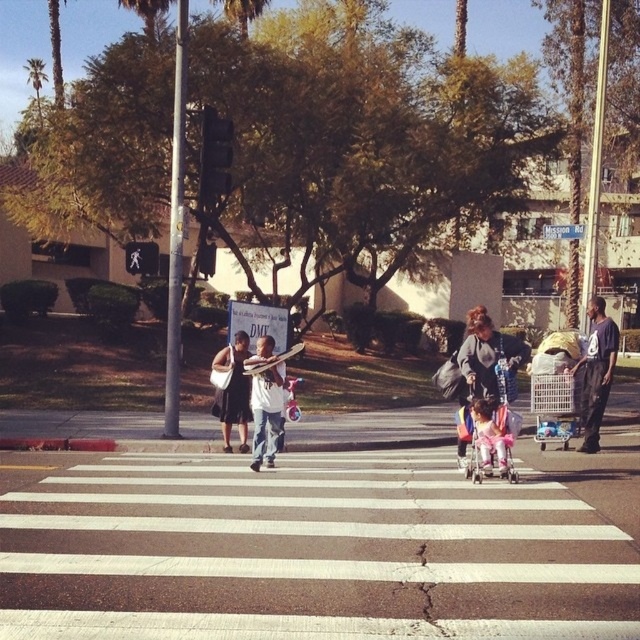
Consider the image. Can you confirm if pink fabric baby carriage at center is smaller than green leafy palm tree at upper left?

Indeed, pink fabric baby carriage at center has a smaller size compared to green leafy palm tree at upper left.

Identify the location of pink fabric baby carriage at center. (486, 440).

The width and height of the screenshot is (640, 640). What are the coordinates of `matte pink stroller at center` in the screenshot? It's located at (488, 360).

Measure the distance from matte pink stroller at center to white cotton shirt at center.

The distance of matte pink stroller at center from white cotton shirt at center is 9.05 feet.

I want to click on matte pink stroller at center, so click(x=488, y=360).

Find the location of a particular element. The height and width of the screenshot is (640, 640). matte pink stroller at center is located at coordinates (488, 360).

Is point (292, 461) farther from camera compared to point (467, 428)?

Yes.

You are a GUI agent. You are given a task and a screenshot of the screen. Output one action in this format:
    pyautogui.click(x=<x>, y=<y>)
    Task: Click on the white asphalt crosswalk at center
    
    Given the screenshot: What is the action you would take?
    pyautogui.click(x=320, y=547)